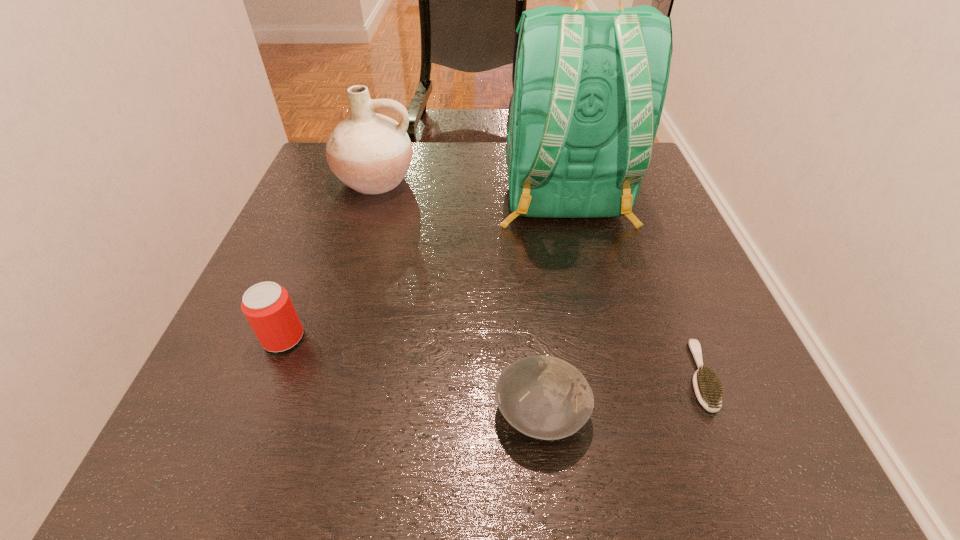
I want to click on the tallest object, so click(589, 87).

The width and height of the screenshot is (960, 540). I want to click on pottery, so click(x=371, y=153).

Where is `the third tallest object`? the third tallest object is located at coordinates (267, 306).

At what (x,y) coordinates should I click in order to perform the action: click on bowl. Please return your answer as a coordinate pair (x, y). The image size is (960, 540). Looking at the image, I should click on (544, 397).

Where is `scrubbing brush`? This screenshot has height=540, width=960. scrubbing brush is located at coordinates (708, 389).

At what (x,y) coordinates should I click in order to perform the action: click on free space located 0.300m on the back of the backpack. Please return your answer as a coordinate pair (x, y). This screenshot has height=540, width=960. Looking at the image, I should click on (603, 367).

This screenshot has width=960, height=540. Identify the location of vacant space located to pour from the handle of the second tallest object. (341, 293).

Where is `free space located on the right of the beer can`? free space located on the right of the beer can is located at coordinates (397, 338).

At what (x,y) coordinates should I click in order to perform the action: click on free space located on the right of the fourth tallest object. Please return your answer as a coordinate pair (x, y). Looking at the image, I should click on (702, 411).

Image resolution: width=960 pixels, height=540 pixels. Find the location of `blank area located on the back of the scrubbing brush`. blank area located on the back of the scrubbing brush is located at coordinates click(x=677, y=320).